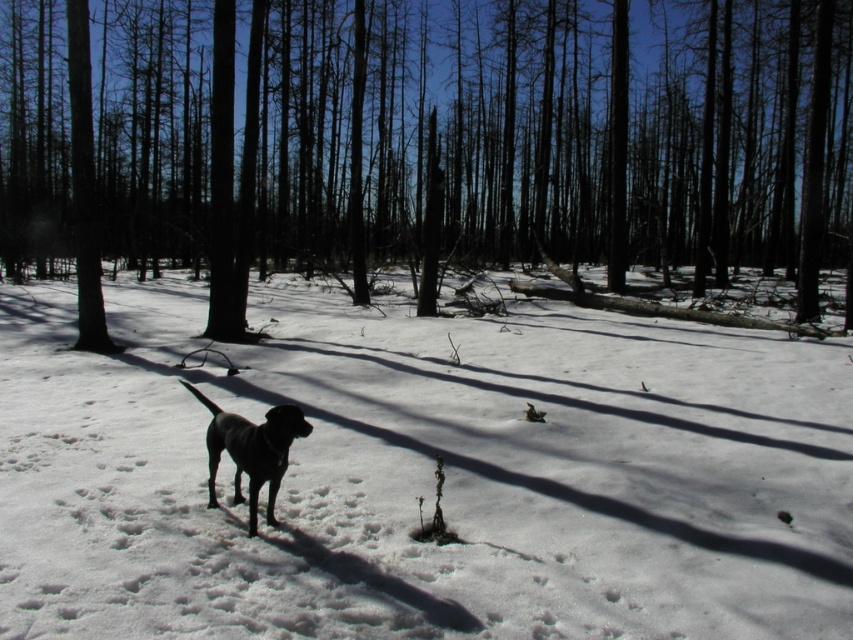
Is the position of brown wood tree at center more distant than that of shiny black dog at center?

Yes, it is behind shiny black dog at center.

Can you confirm if brown wood tree at center is shorter than shiny black dog at center?

In fact, brown wood tree at center may be taller than shiny black dog at center.

What do you see at coordinates (425, 145) in the screenshot? The image size is (853, 640). I see `brown wood tree at center` at bounding box center [425, 145].

You are a GUI agent. You are given a task and a screenshot of the screen. Output one action in this format:
    pyautogui.click(x=<x>, y=<y>)
    Task: Click on the brown wood tree at center
    The height and width of the screenshot is (640, 853).
    Given the screenshot: What is the action you would take?
    pyautogui.click(x=425, y=145)

Can you confirm if white powdery snow at center is shorter than brown wood tree at center?

Yes.

Can you confirm if white powdery snow at center is positioned to the right of brown wood tree at center?

No, white powdery snow at center is not to the right of brown wood tree at center.

Where is `white powdery snow at center`? The image size is (853, 640). white powdery snow at center is located at coordinates (422, 474).

Locate an element on the screen. white powdery snow at center is located at coordinates (422, 474).

Can you confirm if white powdery snow at center is shorter than shiny black dog at center?

Incorrect, white powdery snow at center's height does not fall short of shiny black dog at center's.

Is white powdery snow at center positioned behind shiny black dog at center?

No, it is not.

What do you see at coordinates (422, 474) in the screenshot?
I see `white powdery snow at center` at bounding box center [422, 474].

At what (x,y) coordinates should I click in order to perform the action: click on white powdery snow at center. Please return your answer as a coordinate pair (x, y). Image resolution: width=853 pixels, height=640 pixels. Looking at the image, I should click on (422, 474).